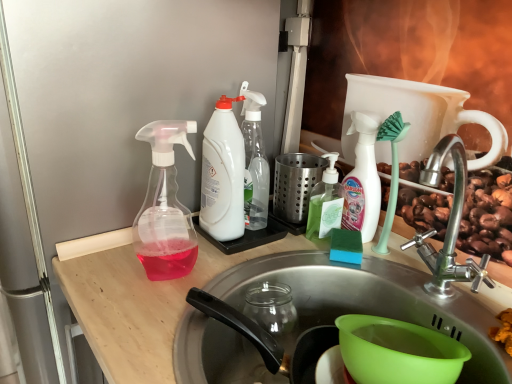
This screenshot has width=512, height=384. What are the coordinates of `free space in front of white matte bottle at center, positioned as the fifth bottle in left-to-right order` in the screenshot? It's located at (390, 276).